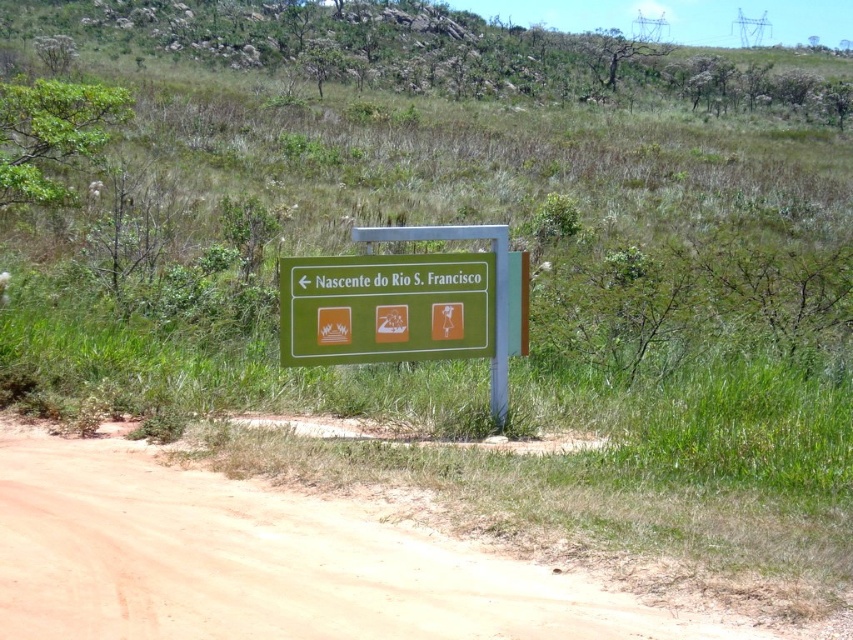
You are a hiker who just arrived at the Nascente do Rio S. Francisco. You see the green plastic sign at center and the green matte sign at center. Which one is positioned lower?

The green plastic sign at center is located below the green matte sign at center, so the green plastic sign at center is positioned lower.